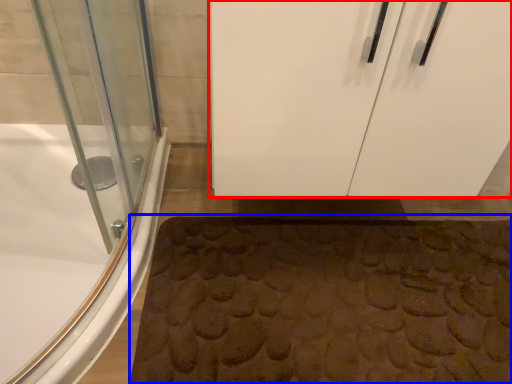
Question: Which object appears closest to the camera in this image, door (highlighted by a red box) or bath mat (highlighted by a blue box)?

Choices:
 (A) door
 (B) bath mat

Answer: (A)